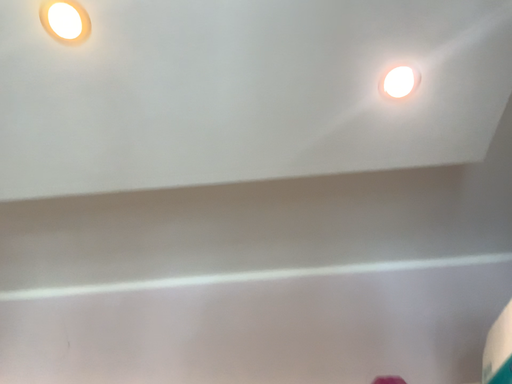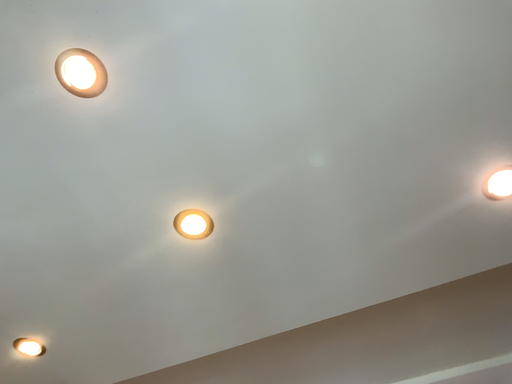
Question: How did the camera likely rotate when shooting the video?

Choices:
 (A) rotated downward
 (B) rotated upward

Answer: (B)